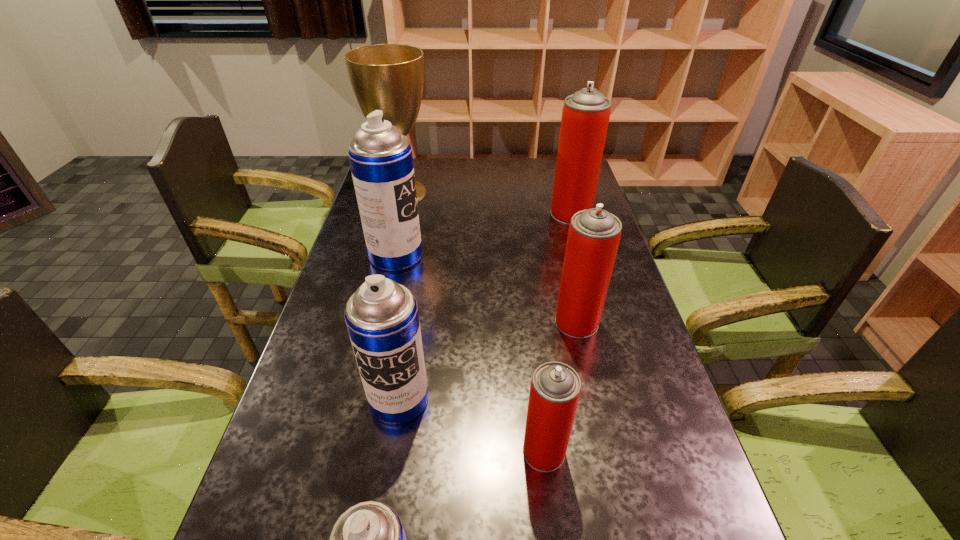
You are a GUI agent. You are given a task and a screenshot of the screen. Output one action in this format:
    pyautogui.click(x=<x>, y=<y>)
    Task: Click on the object at the far left corner
    The height and width of the screenshot is (540, 960).
    Given the screenshot: What is the action you would take?
    pyautogui.click(x=389, y=77)

This screenshot has height=540, width=960. In order to click on vacant space at the far edge of the desktop in this screenshot , I will do `click(527, 182)`.

You are a GUI agent. You are given a task and a screenshot of the screen. Output one action in this format:
    pyautogui.click(x=<x>, y=<y>)
    Task: Click on the free spot at the left edge of the desktop
    The height and width of the screenshot is (540, 960).
    Given the screenshot: What is the action you would take?
    pyautogui.click(x=355, y=223)

Identify the location of vacant space at the right edge of the desktop. (643, 341).

At what (x,y) coordinates should I click in order to perform the action: click on free space at the far right corner of the desktop. Please return your answer as a coordinate pair (x, y). The width and height of the screenshot is (960, 540). Looking at the image, I should click on (556, 169).

Find the location of a particular element. Image resolution: width=960 pixels, height=540 pixels. free spot between the farthest blue aerosol can and the farthest red aerosol can is located at coordinates (484, 234).

Find the location of a particular element. free space between the farthest aerosol can and the biggest blue aerosol can is located at coordinates (484, 234).

Where is `vacant space that's between the third farthest aerosol can and the second farthest aerosol can`? Image resolution: width=960 pixels, height=540 pixels. vacant space that's between the third farthest aerosol can and the second farthest aerosol can is located at coordinates (487, 289).

You are a GUI agent. You are given a task and a screenshot of the screen. Output one action in this format:
    pyautogui.click(x=<x>, y=<y>)
    Task: Click on the free space between the second smallest blue aerosol can and the leftmost red aerosol can
    Image resolution: width=960 pixels, height=540 pixels.
    Given the screenshot: What is the action you would take?
    pyautogui.click(x=471, y=425)

Locate which object ranks fourth in proximity to the second smallest red aerosol can. Please provide its 2D coordinates. Your answer should be formatted as a tuple, i.e. [(x, y)], where the tuple contains the x and y coordinates of a point satisfying the conditions above.

[(380, 157)]